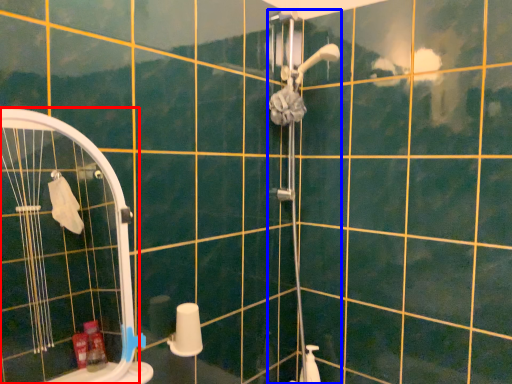
Question: Among these objects, which one is farthest to the camera, screen door (highlighted by a red box) or shower door (highlighted by a blue box)?

Choices:
 (A) screen door
 (B) shower door

Answer: (B)